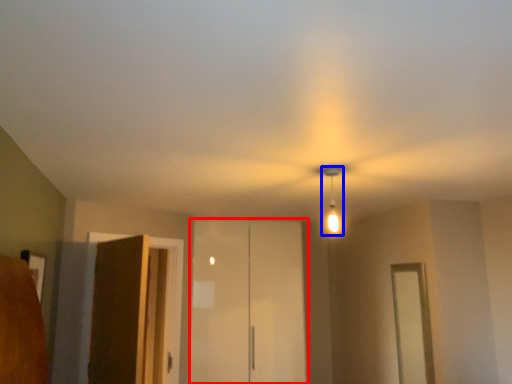
Question: Which point is further to the camera, elevator (highlighted by a red box) or light fixture (highlighted by a blue box)?

Choices:
 (A) elevator
 (B) light fixture

Answer: (A)